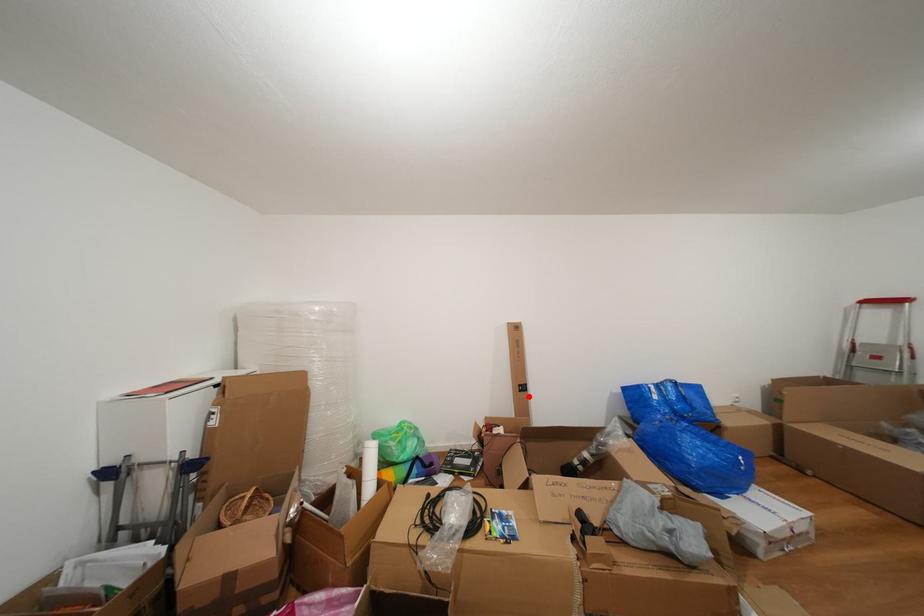
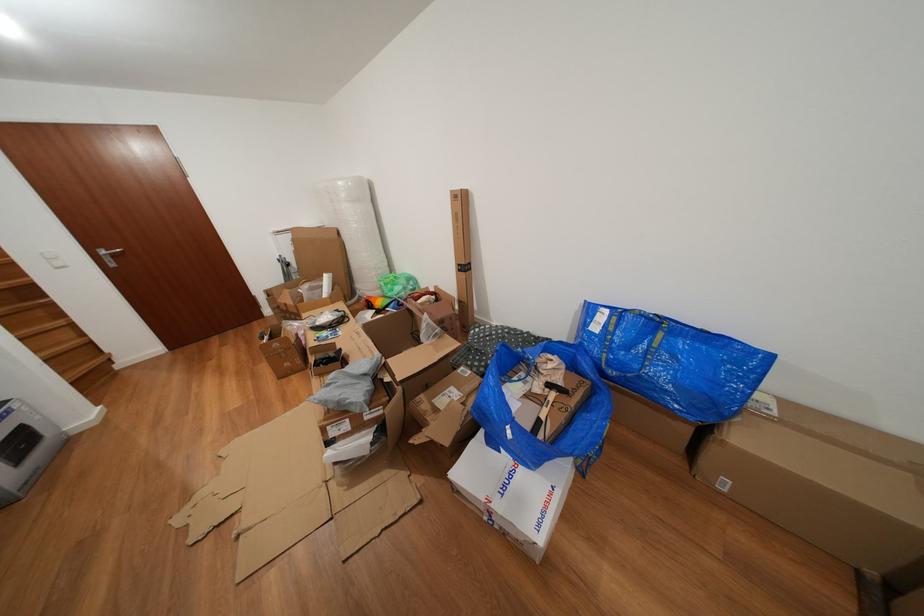
Question: I am providing you with two images of the same scene from different viewpoints. In image1, a red point is highlighted. Considering the same 3D point in image2, which of the following is correct?

Choices:
 (A) It is closer
 (B) It is farther

Answer: (A)